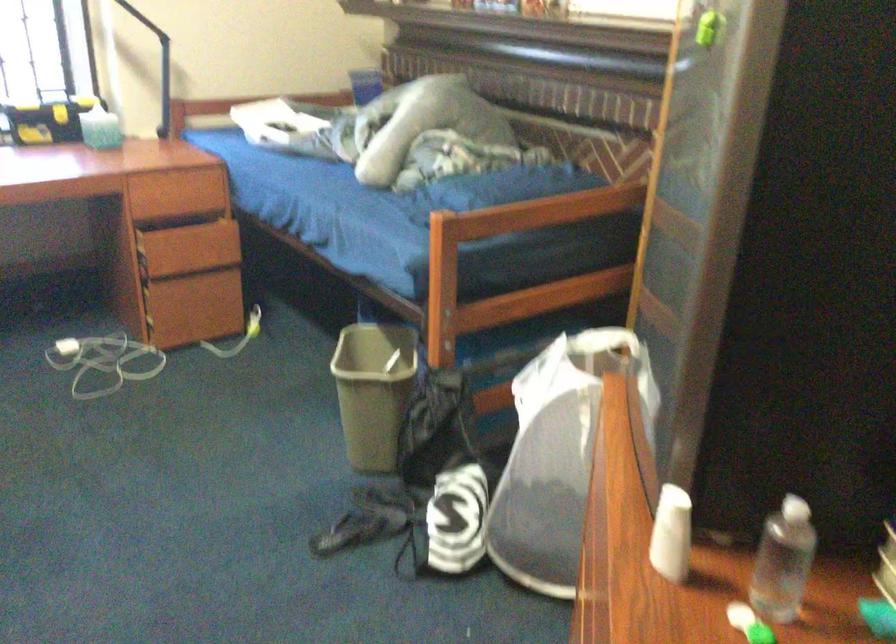
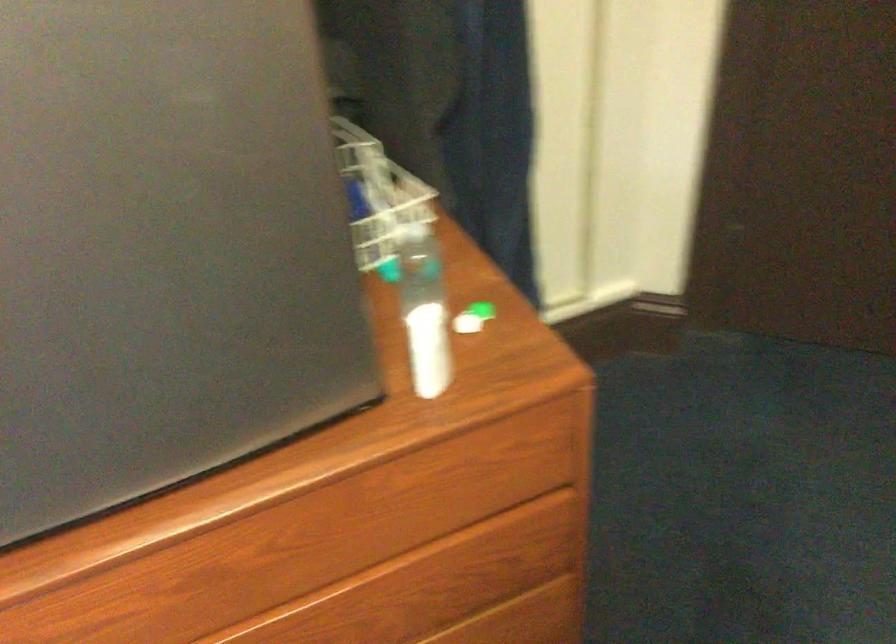
Where in the second image is the point corresponding to (x=730, y=497) from the first image?

(424, 310)